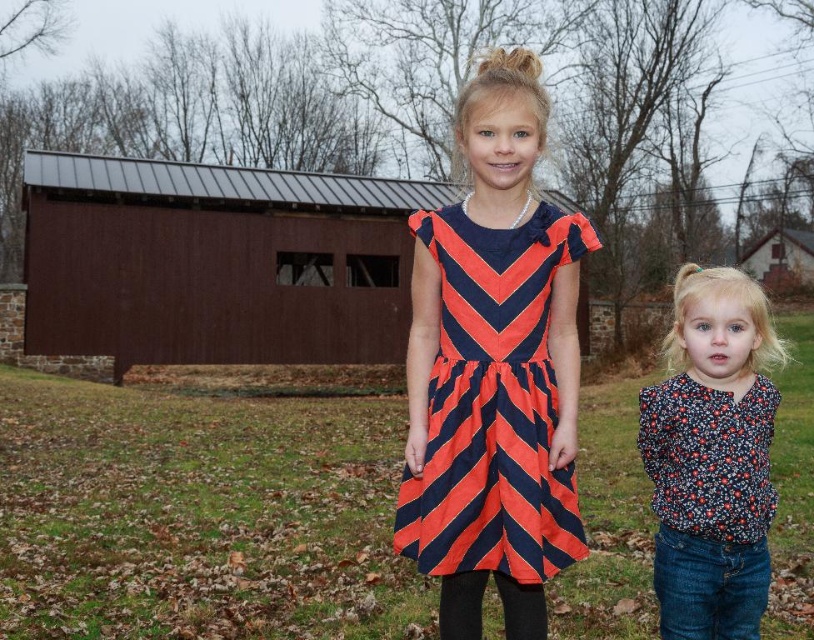
Measure the distance between brown wooden barn at center and orange and navy striped dress at center.

A distance of 21.93 meters exists between brown wooden barn at center and orange and navy striped dress at center.

Who is shorter, brown wooden barn at center or orange and navy striped dress at center?

With less height is orange and navy striped dress at center.

Find the location of a particular element. brown wooden barn at center is located at coordinates (215, 260).

Does brown wooden barn at center have a greater height compared to floral print blouse at lower right?

Yes, brown wooden barn at center is taller than floral print blouse at lower right.

Who is more distant from viewer, [279,214] or [772,410]?

Point [279,214]

Describe the element at coordinates (215, 260) in the screenshot. I see `brown wooden barn at center` at that location.

Identify the location of brown wooden barn at center. This screenshot has width=814, height=640. (215, 260).

Between orange and navy striped dress at center and floral print blouse at lower right, which one is positioned lower?

floral print blouse at lower right is lower down.

Between point (495, 561) and point (703, 502), which one is positioned behind?

Point (703, 502)

The width and height of the screenshot is (814, 640). Describe the element at coordinates (493, 403) in the screenshot. I see `orange and navy striped dress at center` at that location.

You are a GUI agent. You are given a task and a screenshot of the screen. Output one action in this format:
    pyautogui.click(x=<x>, y=<y>)
    Task: Click on the orange and navy striped dress at center
    
    Given the screenshot: What is the action you would take?
    pyautogui.click(x=493, y=403)